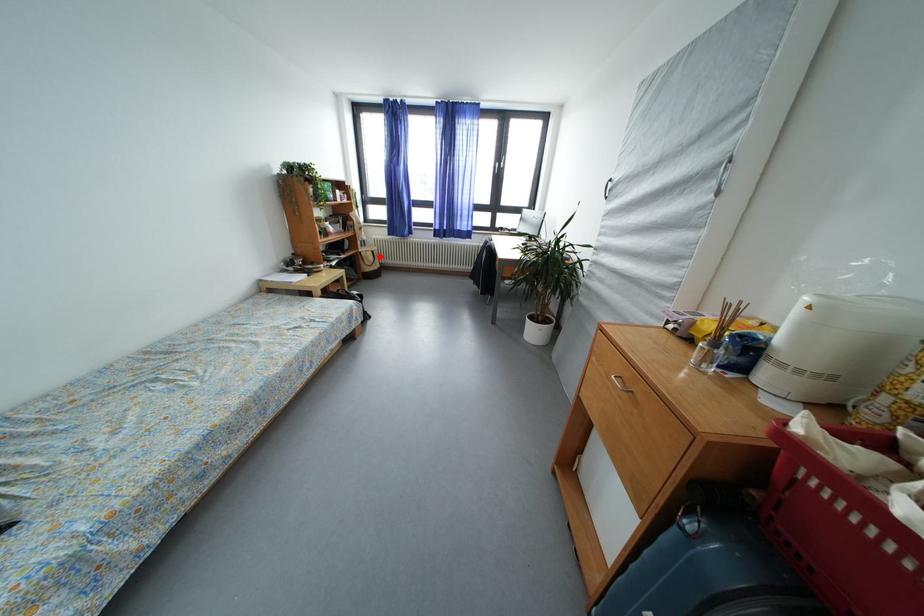
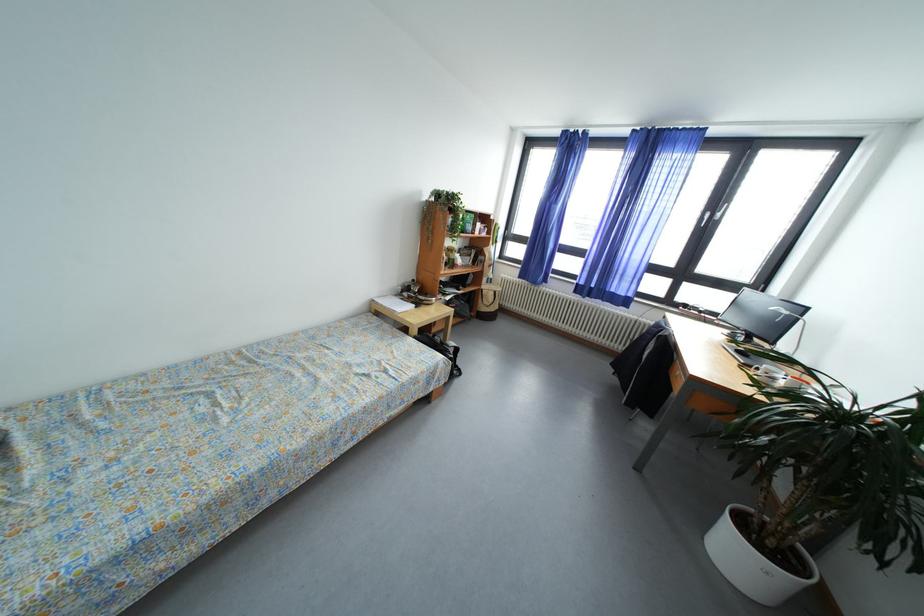
In the second image, find the point that corresponds to the highlighted location in the first image.

(502, 297)